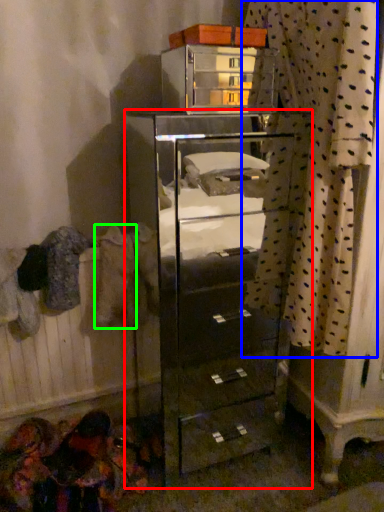
Question: Which object is the farthest from chest of drawers (highlighted by a red box)? Choose among these: curtain (highlighted by a blue box) or clothing (highlighted by a green box).

Choices:
 (A) curtain
 (B) clothing

Answer: (B)